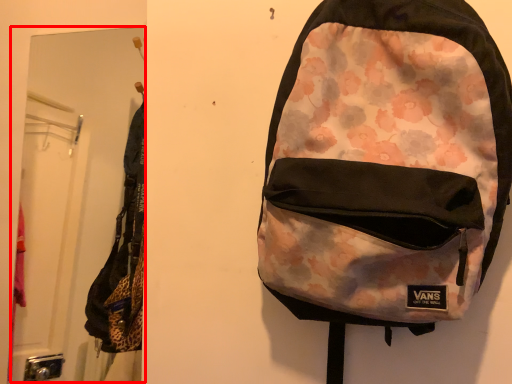
Question: From the image's perspective, what is the correct spatial positioning of mirror (annotated by the red box) in reference to backpack?

Choices:
 (A) below
 (B) above

Answer: (B)